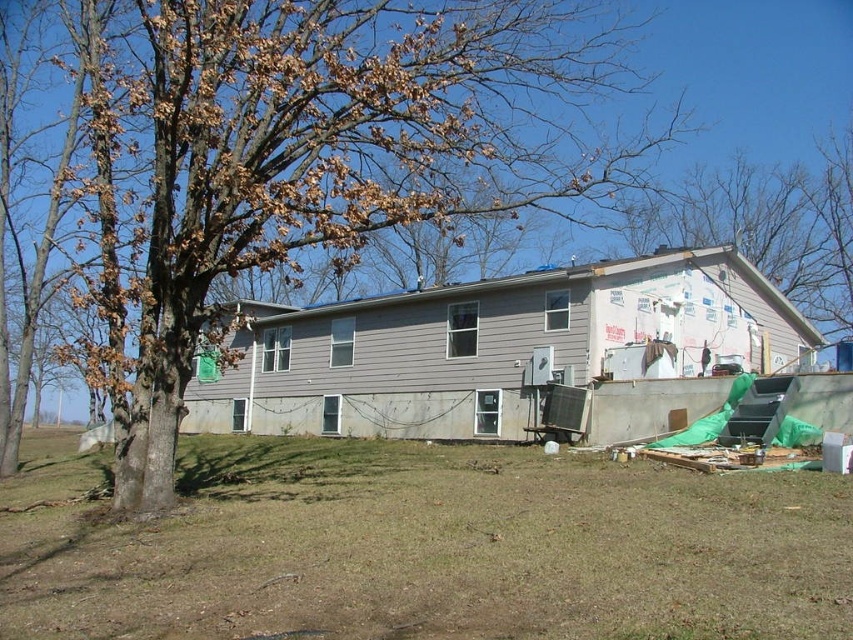
Can you confirm if brown grass at lower center is positioned to the left of brown leafy tree at left?

No, brown grass at lower center is not to the left of brown leafy tree at left.

Between point (310, 580) and point (392, 99), which one is positioned in front?

Point (310, 580) is more forward.

Between point (715, 576) and point (305, 100), which one is positioned in front?

Point (715, 576)

Identify the location of brown grass at lower center. This screenshot has width=853, height=640. (422, 547).